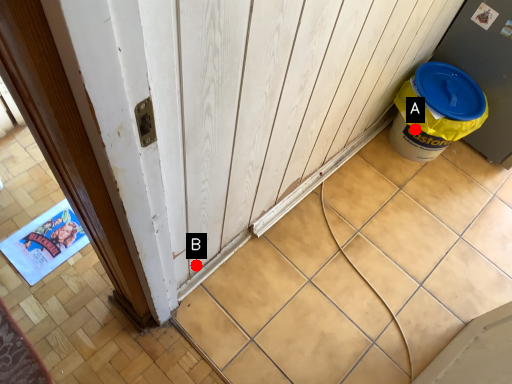
Question: Two points are circled on the image, labeled by A and B beside each circle. Which of the following is the farthest from the observer?

Choices:
 (A) A is further
 (B) B is further

Answer: (A)